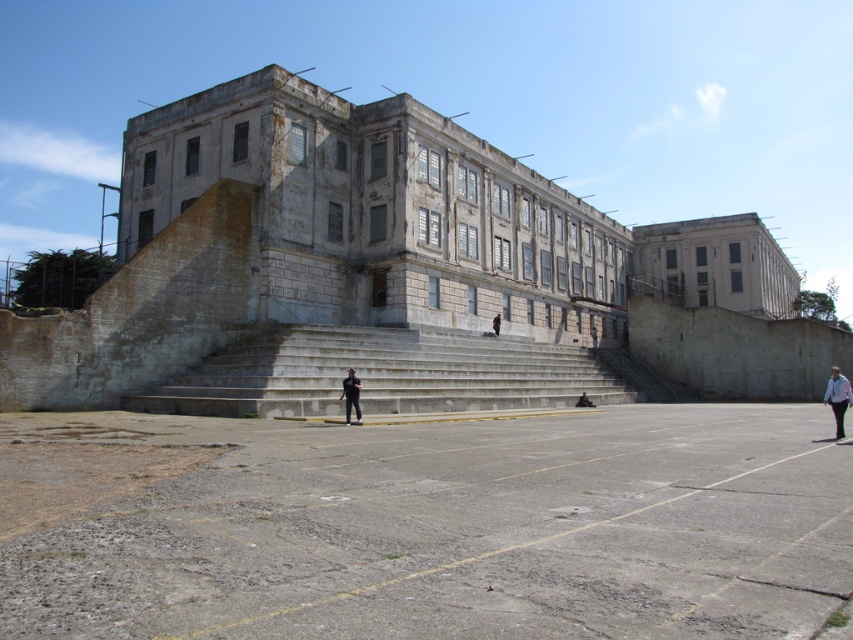
Between concrete stairs at center and white shirt at lower right, which one is positioned higher?

Positioned higher is concrete stairs at center.

Does concrete stairs at center come behind white shirt at lower right?

That is True.

Is point (190, 381) positioned before point (843, 410)?

No, it is behind (843, 410).

Locate an element on the screen. concrete stairs at center is located at coordinates (396, 372).

Who is positioned more to the left, white shirt at lower right or black matte pants at center?

black matte pants at center is more to the left.

Can you confirm if white shirt at lower right is thinner than black matte pants at center?

Incorrect, white shirt at lower right's width is not less than black matte pants at center's.

Is point (850, 392) positioned in front of point (360, 413)?

Yes, it is in front of point (360, 413).

The height and width of the screenshot is (640, 853). I want to click on white shirt at lower right, so click(x=837, y=397).

Is black matte pants at center closer to the viewer compared to black fabric at center?

Yes, black matte pants at center is in front of black fabric at center.

Is black matte pants at center smaller than black fabric at center?

Yes, black matte pants at center is smaller than black fabric at center.

What do you see at coordinates (351, 396) in the screenshot?
I see `black matte pants at center` at bounding box center [351, 396].

Locate an element on the screen. black matte pants at center is located at coordinates (351, 396).